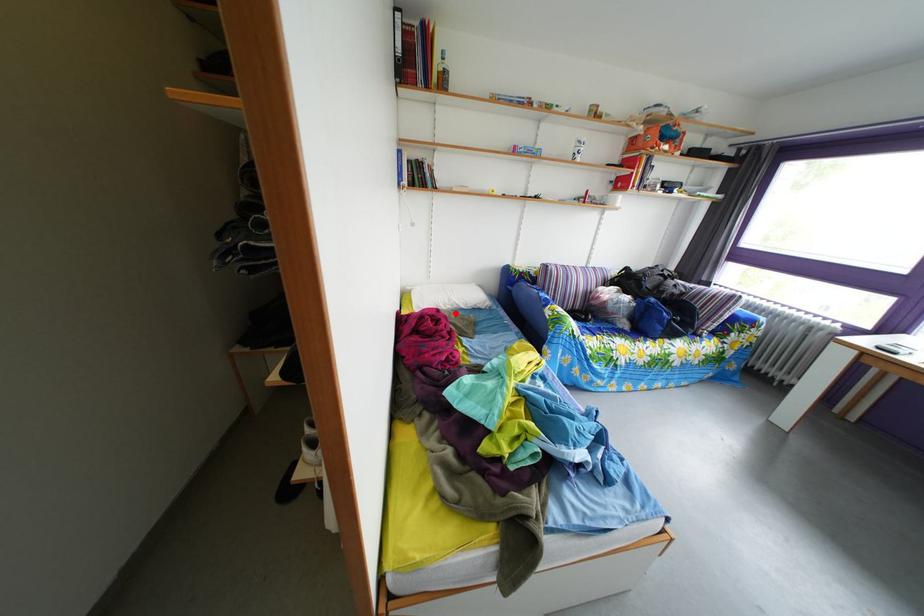
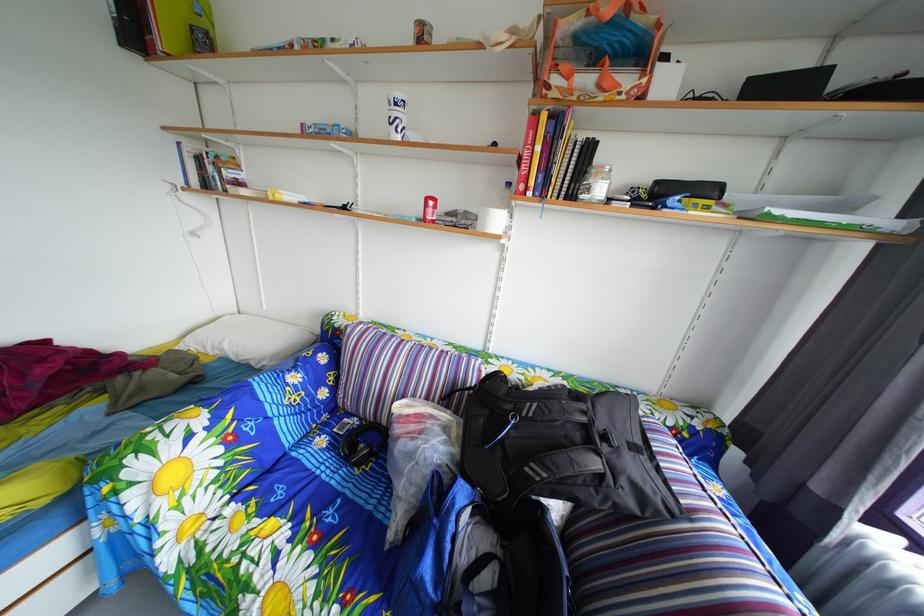
Question: I am providing you with two images of the same scene from different viewpoints. In image1, a red point is highlighted. Considering the same 3D point in image2, which of the following is correct?

Choices:
 (A) It is closer
 (B) It is farther

Answer: (B)